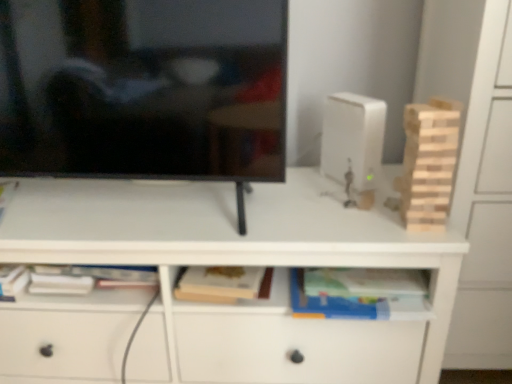
This screenshot has width=512, height=384. Describe the element at coordinates (428, 163) in the screenshot. I see `light wood block tower at right` at that location.

The width and height of the screenshot is (512, 384). I want to click on hardcover book at center, so click(352, 291).

What is the approximate height of white matte desk at center?

21.69 inches.

Locate an element on the screen. The image size is (512, 384). light wood block tower at right is located at coordinates (428, 163).

How many degrees apart are the facing directions of hardcover book at center and wooden tower at right?

0.127 degrees.

Would you say wooden tower at right is part of hardcover book at center's contents?

No, wooden tower at right is not inside hardcover book at center.

From the image's perspective, is hardcover book at center positioned above or below wooden tower at right?

hardcover book at center is below wooden tower at right.

Looking at this image, how much distance is there between light wood block tower at right and wooden tower at right?

light wood block tower at right and wooden tower at right are 6.00 inches apart from each other.

Can you confirm if light wood block tower at right is taller than wooden tower at right?

No.

Looking at this image, is light wood block tower at right touching wooden tower at right?

No, light wood block tower at right is not next to wooden tower at right.

Visually, is light wood block tower at right positioned to the left or to the right of wooden tower at right?

light wood block tower at right is to the left of wooden tower at right.

Is black glossy television at upper left positioned far away from wooden tower at right?

They are positioned close to each other.

Is black glossy television at upper left completely or partially outside of wooden tower at right?

Indeed, black glossy television at upper left is completely outside wooden tower at right.

Could you tell me if black glossy television at upper left is facing wooden tower at right?

No, black glossy television at upper left does not turn towards wooden tower at right.

Which of these two, black glossy television at upper left or wooden tower at right, stands shorter?

→ Standing shorter between the two is black glossy television at upper left.

There is a white matte desk at center. At what (x,y) coordinates should I click in order to perform the action: click on television above it (from a real-world perspective). Please return your answer as a coordinate pair (x, y). The width and height of the screenshot is (512, 384). Looking at the image, I should click on (143, 89).

Is black glossy television at upper left facing away from white matte desk at center?

That's not correct — black glossy television at upper left is not looking away from white matte desk at center.

Is black glossy television at upper left wider than white matte desk at center?

Incorrect, the width of black glossy television at upper left does not surpass that of white matte desk at center.

Which object is more forward, black glossy television at upper left or white matte desk at center?

black glossy television at upper left is closer to the camera.

Is point (447, 203) positioned behind point (59, 165)?

That is False.

In terms of height, does light wood block tower at right look taller or shorter compared to black glossy television at upper left?

In the image, light wood block tower at right appears to be shorter than black glossy television at upper left.

Is light wood block tower at right completely or partially outside of black glossy television at upper left?

Yes.

How distant is light wood block tower at right from black glossy television at upper left?

light wood block tower at right is 49.04 centimeters away from black glossy television at upper left.

Does hardcover book at center appear on the right side of black glossy television at upper left?

Yes, hardcover book at center is to the right of black glossy television at upper left.

Is hardcover book at center not inside black glossy television at upper left?

Indeed, hardcover book at center is completely outside black glossy television at upper left.

Which of these two, hardcover book at center or black glossy television at upper left, stands taller?

Standing taller between the two is black glossy television at upper left.

Does point (313, 275) lie in front of point (177, 54)?

No, (313, 275) is behind (177, 54).

Does hardcover book at center turn towards white matte desk at center?

Yes, hardcover book at center is aimed at white matte desk at center.

This screenshot has height=384, width=512. What are the coordinates of `desk below the hardcover book at center (from a real-world perspective)` in the screenshot? It's located at (245, 264).

Between hardcover book at center and white matte desk at center, which one has larger width?

Wider between the two is white matte desk at center.

Is hardcover book at center not near white matte desk at center?

No.

I want to click on cabinetry that appears above the hardcover book at center (from the image's perspective), so click(x=476, y=167).

The width and height of the screenshot is (512, 384). In the image, there is a light wood block tower at right. What are the coordinates of `cabinetry below it (from a real-world perspective)` in the screenshot? It's located at (476, 167).

Based on their spatial positions, is hardcover book at center or white matte desk at center closer to wooden tower at right?

The object closer to wooden tower at right is hardcover book at center.

From the image, which object appears to be nearer to wooden tower at right, hardcover book at center or light wood block tower at right?

Among the two, light wood block tower at right is located nearer to wooden tower at right.

When comparing their distances from light wood block tower at right, does white matte desk at center or wooden tower at right seem further?

white matte desk at center.

Looking at the image, which one is located closer to white matte desk at center, light wood block tower at right or black glossy television at upper left?

black glossy television at upper left is closer to white matte desk at center.

Considering their positions, is wooden tower at right positioned closer to light wood block tower at right than white matte desk at center?

Based on the image, wooden tower at right appears to be nearer to light wood block tower at right.

Consider the image. When comparing their distances from hardcover book at center, does black glossy television at upper left or wooden tower at right seem further?

black glossy television at upper left is positioned further to the anchor hardcover book at center.

From the image, which object appears to be farther from hardcover book at center, black glossy television at upper left or light wood block tower at right?

black glossy television at upper left.

Based on their spatial positions, is black glossy television at upper left or wooden tower at right closer to white matte desk at center?

The object closer to white matte desk at center is black glossy television at upper left.

Locate an element on the screen. The height and width of the screenshot is (384, 512). book located between black glossy television at upper left and wooden tower at right in the left-right direction is located at coordinates (352, 291).

At what (x,y) coordinates should I click in order to perform the action: click on book situated between white matte desk at center and light wood block tower at right from left to right. Please return your answer as a coordinate pair (x, y). This screenshot has height=384, width=512. Looking at the image, I should click on (352, 291).

You are a GUI agent. You are given a task and a screenshot of the screen. Output one action in this format:
    pyautogui.click(x=<x>, y=<y>)
    Task: Click on the book between black glossy television at upper left and light wood block tower at right in the horizontal direction
    Image resolution: width=512 pixels, height=384 pixels.
    Given the screenshot: What is the action you would take?
    pyautogui.click(x=352, y=291)

At what (x,y) coordinates should I click in order to perform the action: click on toy situated between hardcover book at center and wooden tower at right from left to right. Please return your answer as a coordinate pair (x, y). Looking at the image, I should click on (428, 163).